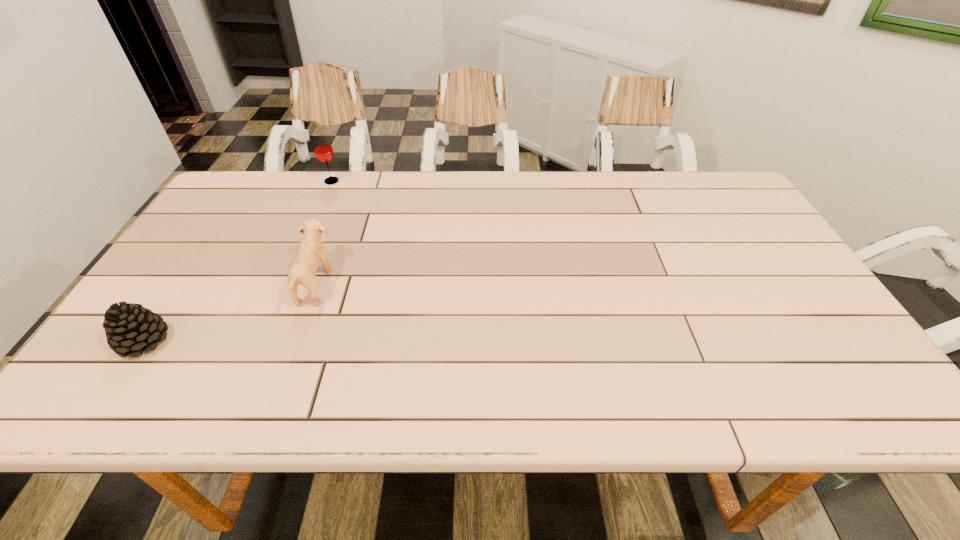
This screenshot has height=540, width=960. Identify the location of free region that satisfies the following two spatial constraints: 1. on the front side of the glass; 2. at the narrow end of the pinecone. (263, 341).